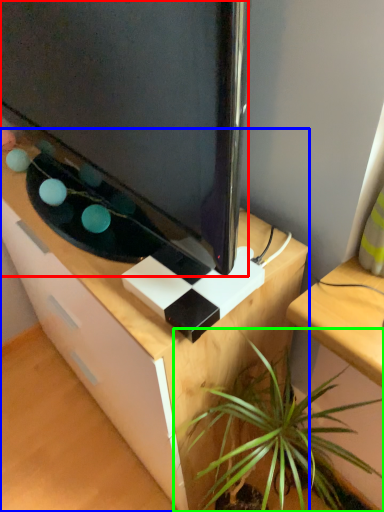
Question: Considering the real-world distances, which object is closest to television (highlighted by a red box)? desk (highlighted by a blue box) or houseplant (highlighted by a green box).

Choices:
 (A) desk
 (B) houseplant

Answer: (A)